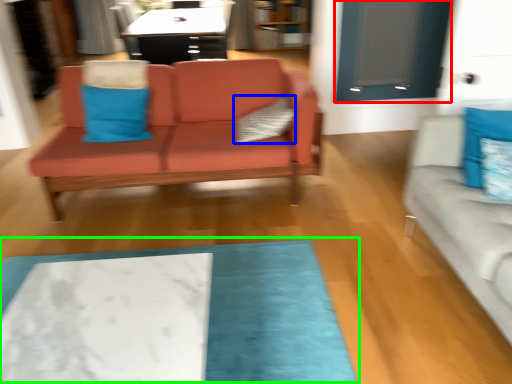
Question: Based on their relative distances, which object is farther from glass door (highlighted by a red box)? Choose from pillow (highlighted by a blue box) and mat (highlighted by a green box).

Choices:
 (A) pillow
 (B) mat

Answer: (B)